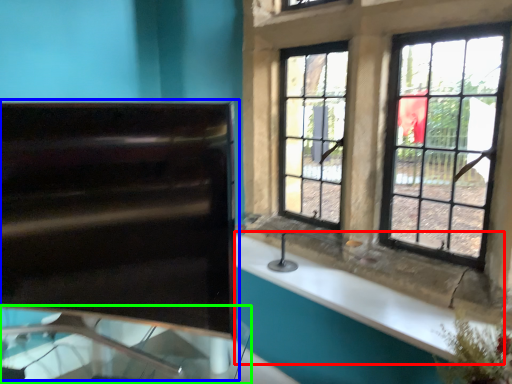
Question: Which object is the farthest from counter top (highlighted by a red box)? Choose among these: sink (highlighted by a blue box) or glass table (highlighted by a green box).

Choices:
 (A) sink
 (B) glass table

Answer: (A)